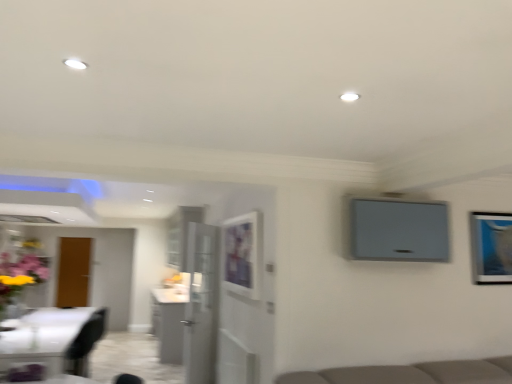
Question: Can you confirm if matte purple vase at left is bigger than white glossy cabinet at center?

Choices:
 (A) no
 (B) yes

Answer: (A)

Question: Is matte purple vase at left not inside white glossy cabinet at center?

Choices:
 (A) yes
 (B) no

Answer: (A)

Question: Considering the relative sizes of matte purple vase at left and white glossy cabinet at center in the image provided, is matte purple vase at left taller than white glossy cabinet at center?

Choices:
 (A) no
 (B) yes

Answer: (A)

Question: Is matte purple vase at left far away from white glossy cabinet at center?

Choices:
 (A) no
 (B) yes

Answer: (B)

Question: Considering the relative sizes of matte purple vase at left and white glossy cabinet at center in the image provided, is matte purple vase at left thinner than white glossy cabinet at center?

Choices:
 (A) yes
 (B) no

Answer: (A)

Question: From the image's perspective, is white glossy cabinet at center above or below transparent glass door at center?

Choices:
 (A) above
 (B) below

Answer: (B)

Question: Relative to transparent glass door at center, is white glossy cabinet at center in front or behind?

Choices:
 (A) behind
 (B) front

Answer: (A)

Question: Is white glossy cabinet at center spatially inside transparent glass door at center, or outside of it?

Choices:
 (A) inside
 (B) outside

Answer: (B)

Question: Is white glossy cabinet at center wider or thinner than transparent glass door at center?

Choices:
 (A) thin
 (B) wide

Answer: (B)

Question: Does point (490, 235) appear closer or farther from the camera than point (8, 264)?

Choices:
 (A) farther
 (B) closer

Answer: (B)

Question: Is metallic silver picture frame at upper right, which ranks as the 2th picture frame in left-to-right order, bigger or smaller than matte purple vase at left?

Choices:
 (A) small
 (B) big

Answer: (A)

Question: Would you say metallic silver picture frame at upper right, which is the 1th picture frame in right-to-left order, is to the left or to the right of matte purple vase at left in the picture?

Choices:
 (A) right
 (B) left

Answer: (A)

Question: Relative to matte purple vase at left, is metallic silver picture frame at upper right, which ranks as the 2th picture frame in left-to-right order, in front or behind?

Choices:
 (A) behind
 (B) front

Answer: (B)

Question: Considering the positions of white glossy cabinet at center and matte white picture frame at center, the second picture frame from the right, in the image, is white glossy cabinet at center bigger or smaller than matte white picture frame at center, the second picture frame from the right,?

Choices:
 (A) small
 (B) big

Answer: (B)

Question: From the image's perspective, relative to matte white picture frame at center, acting as the first picture frame starting from the left, is white glossy cabinet at center above or below?

Choices:
 (A) below
 (B) above

Answer: (A)